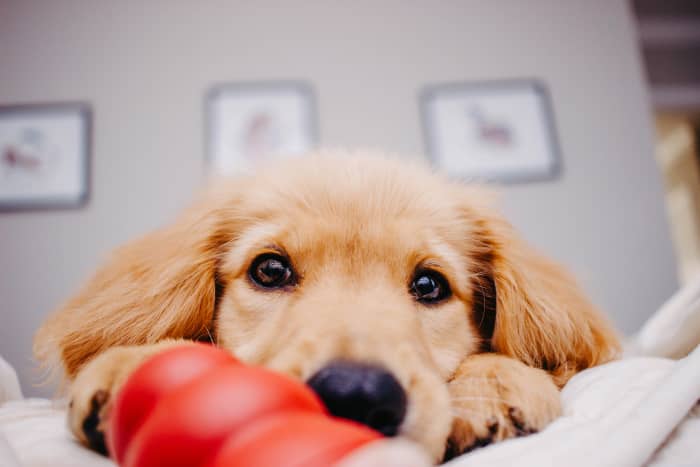
At what (x,y) coordinates should I click in order to perform the action: click on white wall. Please return your answer as a coordinate pair (x, y). Looking at the image, I should click on (360, 50).